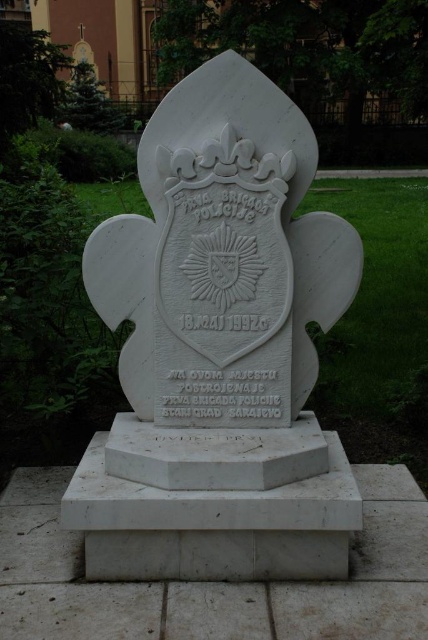
Is point (216, 234) positioned before point (264, 472)?

No.

Can you confirm if white marble monument at center is taller than white marble gravestone at lower center?

Yes, white marble monument at center is taller than white marble gravestone at lower center.

Locate an element on the screen. This screenshot has width=428, height=640. white marble monument at center is located at coordinates (219, 348).

Where is `white marble monument at center`? This screenshot has width=428, height=640. white marble monument at center is located at coordinates (219, 348).